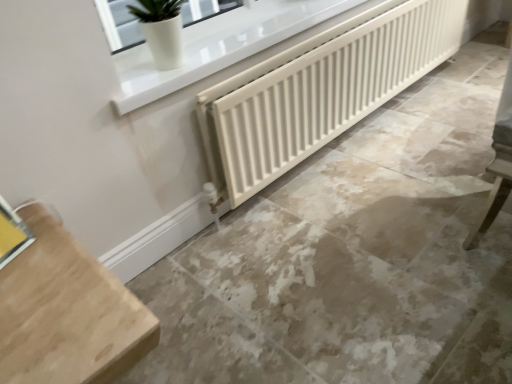
The image size is (512, 384). Identify the location of free location to the right of yellow cardboard at lower left, the 2th window when ordered from right to left. (x=50, y=256).